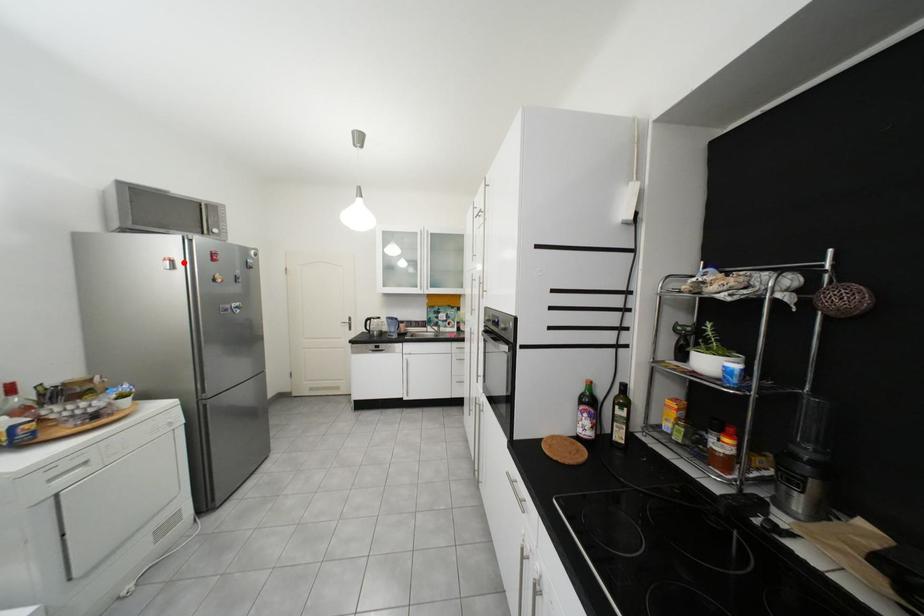
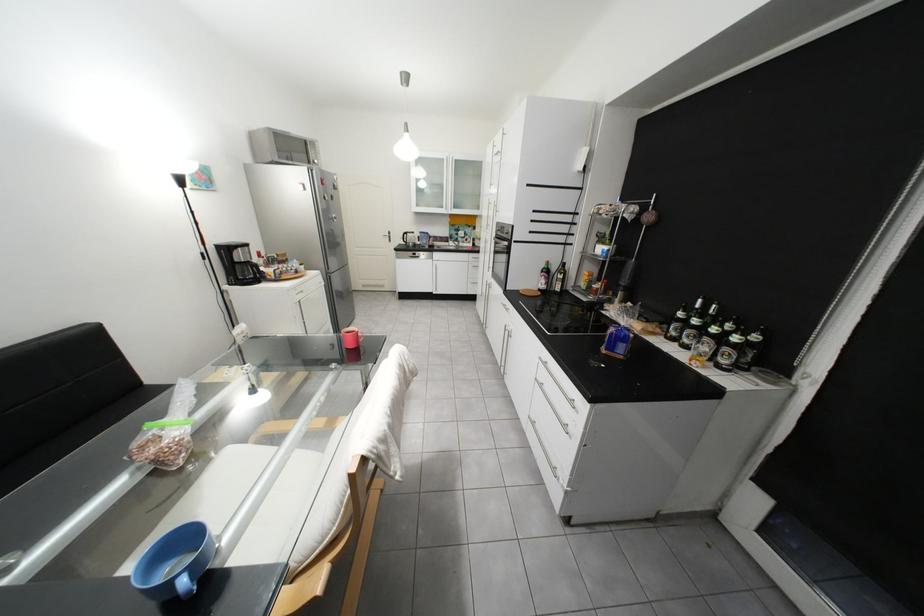
Find the pixel in the second image that matches the highlighted location in the first image.

(315, 185)